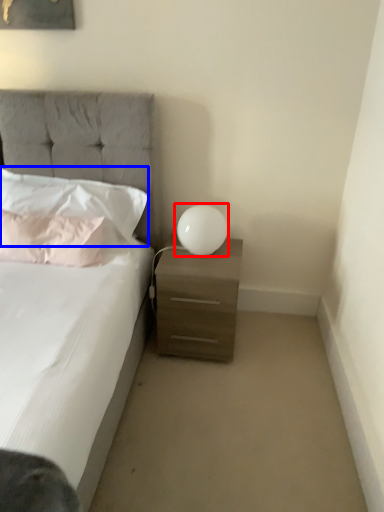
Question: Which object appears closest to the camera in this image, table lamp (highlighted by a red box) or pillow (highlighted by a blue box)?

Choices:
 (A) table lamp
 (B) pillow

Answer: (B)